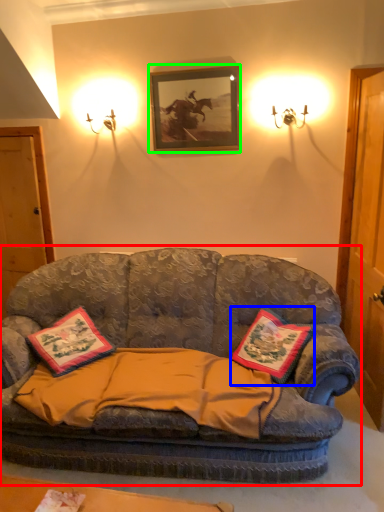
Question: Which is farther away from studio couch (highlighted by a red box)? pillow (highlighted by a blue box) or picture frame (highlighted by a green box)?

Choices:
 (A) pillow
 (B) picture frame

Answer: (B)